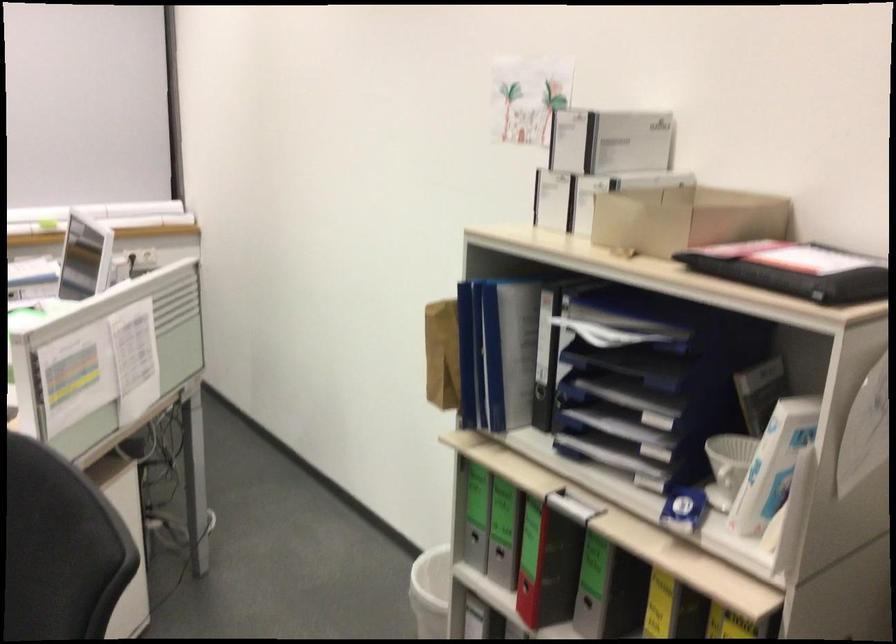
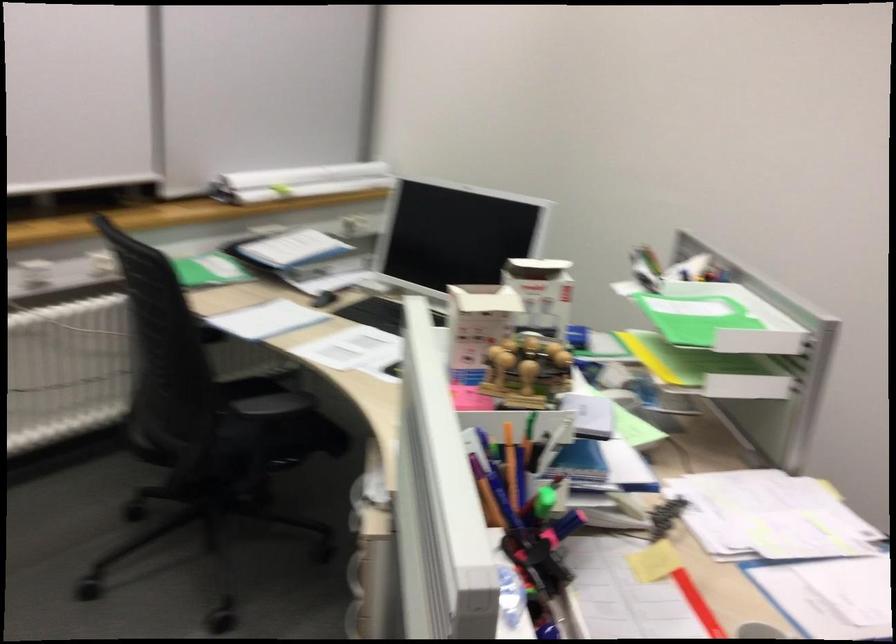
Question: Which direction would the cameraman need to move to produce the second image? Reply with the corresponding letter.

Choices:
 (A) Left
 (B) Right
 (C) Forward
 (D) Backward

Answer: (A)